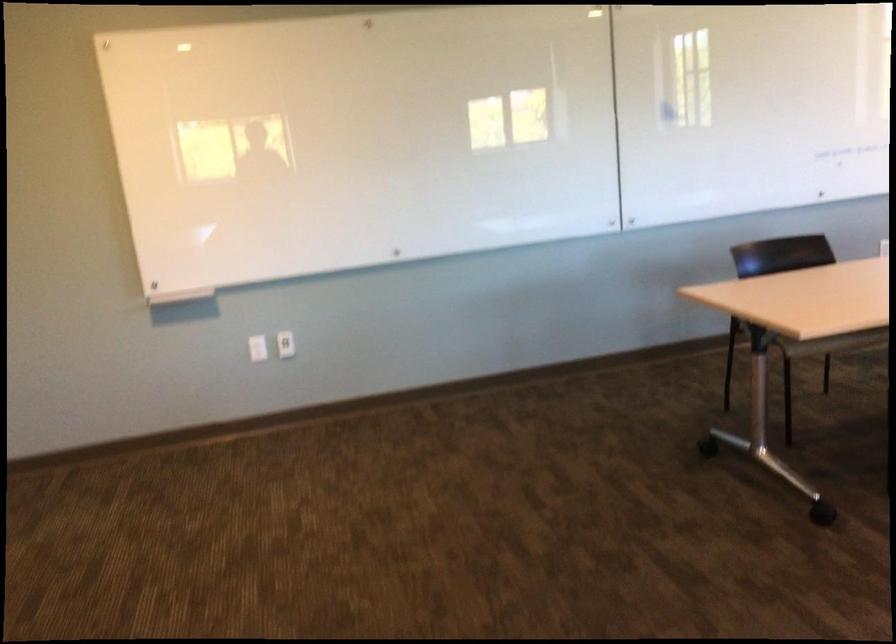
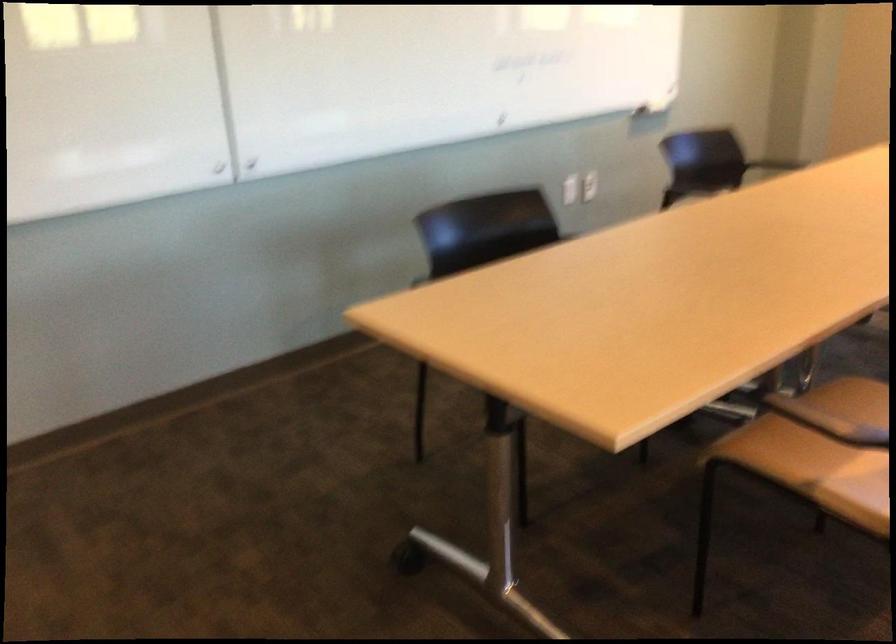
Question: The images are taken continuously from a first-person perspective. In which direction are you moving?

Choices:
 (A) Left
 (B) Right
 (C) Forward
 (D) Backward

Answer: (C)